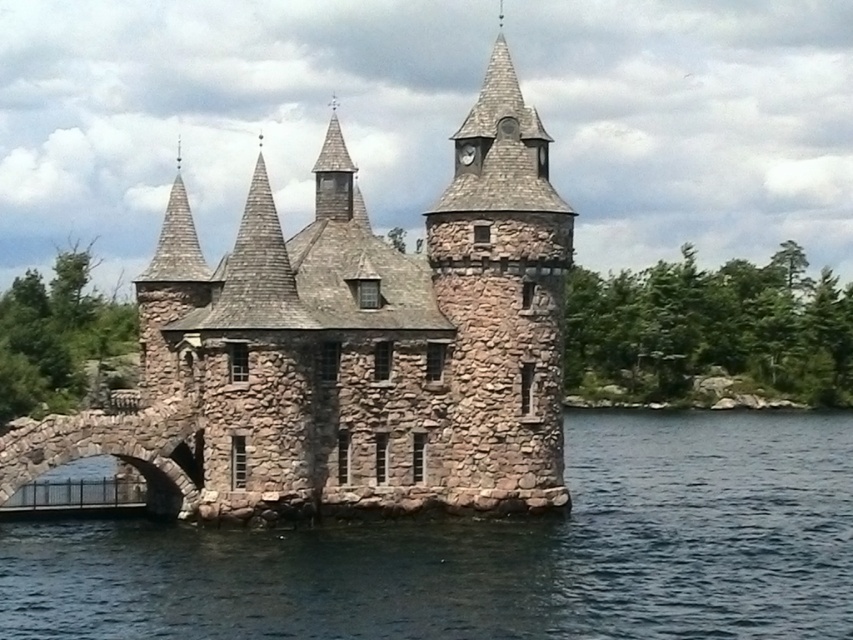
Between clear blue water at lower center and stone arched bridge at lower left, which one appears on the left side from the viewer's perspective?

Positioned to the left is stone arched bridge at lower left.

Is the position of clear blue water at lower center less distant than that of stone arched bridge at lower left?

Yes.

Locate an element on the screen. The image size is (853, 640). clear blue water at lower center is located at coordinates (495, 552).

Identify the location of clear blue water at lower center. (495, 552).

Is clear blue water at lower center behind rustic stone tower at center?

No.

Is clear blue water at lower center wider than rustic stone tower at center?

Correct, the width of clear blue water at lower center exceeds that of rustic stone tower at center.

What do you see at coordinates (495, 552) in the screenshot? The width and height of the screenshot is (853, 640). I see `clear blue water at lower center` at bounding box center [495, 552].

This screenshot has width=853, height=640. Identify the location of clear blue water at lower center. (495, 552).

Where is `rustic stone castle at center`? rustic stone castle at center is located at coordinates (349, 346).

Between rustic stone castle at center and rustic stone tower at center, which one appears on the left side from the viewer's perspective?

rustic stone castle at center is more to the left.

You are a GUI agent. You are given a task and a screenshot of the screen. Output one action in this format:
    pyautogui.click(x=<x>, y=<y>)
    Task: Click on the rustic stone castle at center
    The image size is (853, 640).
    Given the screenshot: What is the action you would take?
    pyautogui.click(x=349, y=346)